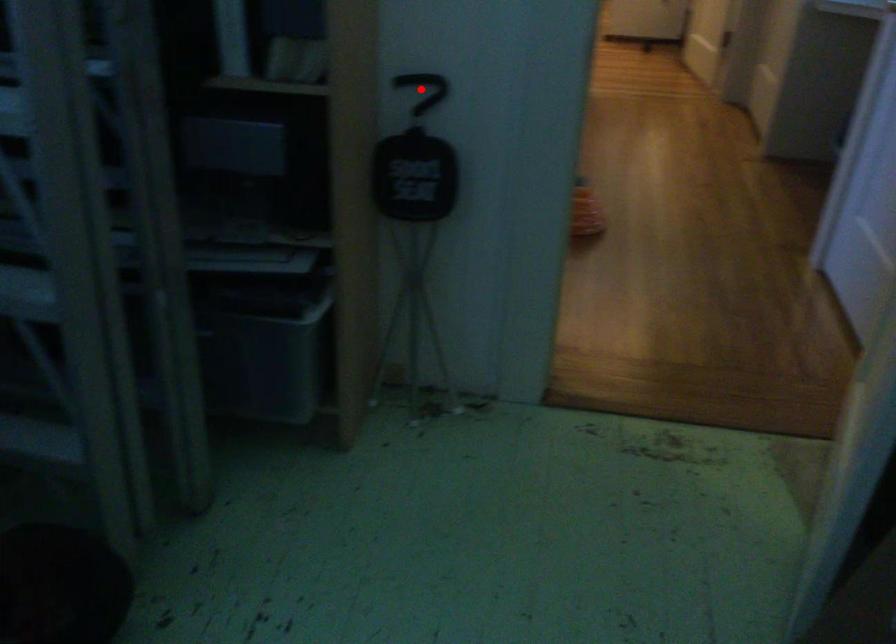
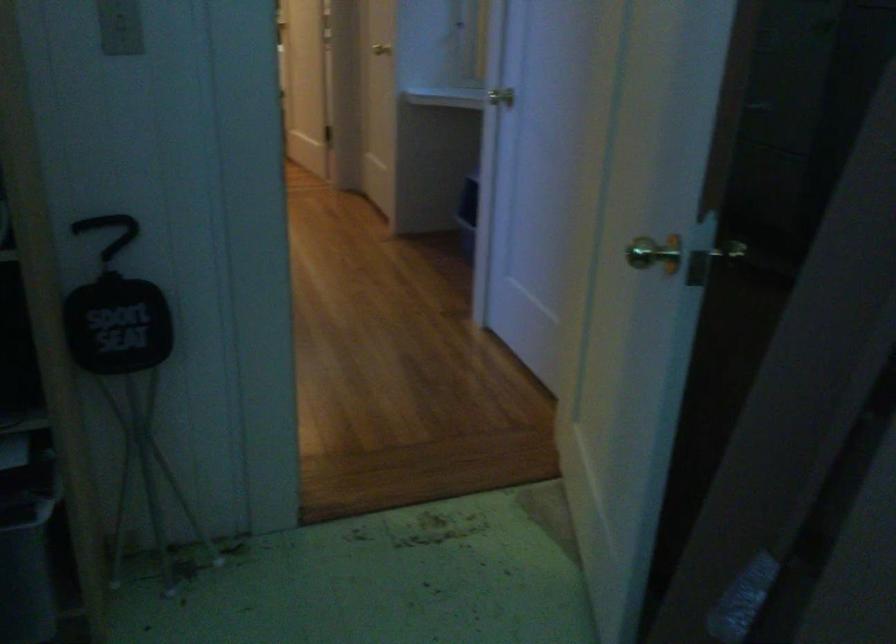
Question: I am providing you with two images of the same scene from different viewpoints. In image1, a red point is highlighted. Considering the same 3D point in image2, which of the following is correct?

Choices:
 (A) It is closer
 (B) It is farther

Answer: (A)